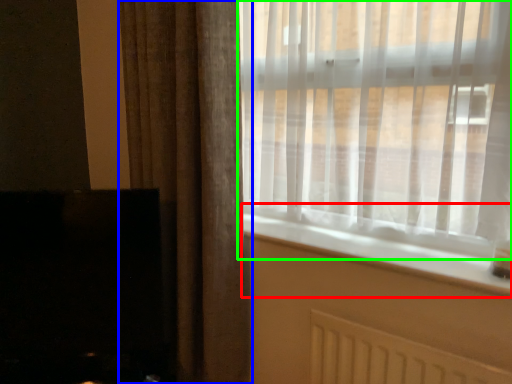
Question: Which object is positioned closest to window sill (highlighted by a red box)? Select from curtain (highlighted by a blue box) and window (highlighted by a green box).

Choices:
 (A) curtain
 (B) window

Answer: (B)